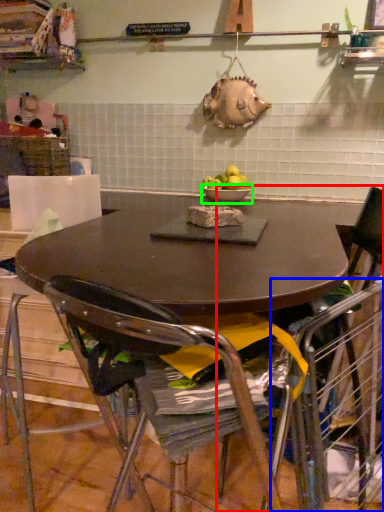
Question: Considering the real-world distances, which object is closest to chair (highlighted by a red box)? armchair (highlighted by a blue box) or bowl (highlighted by a green box).

Choices:
 (A) armchair
 (B) bowl

Answer: (A)